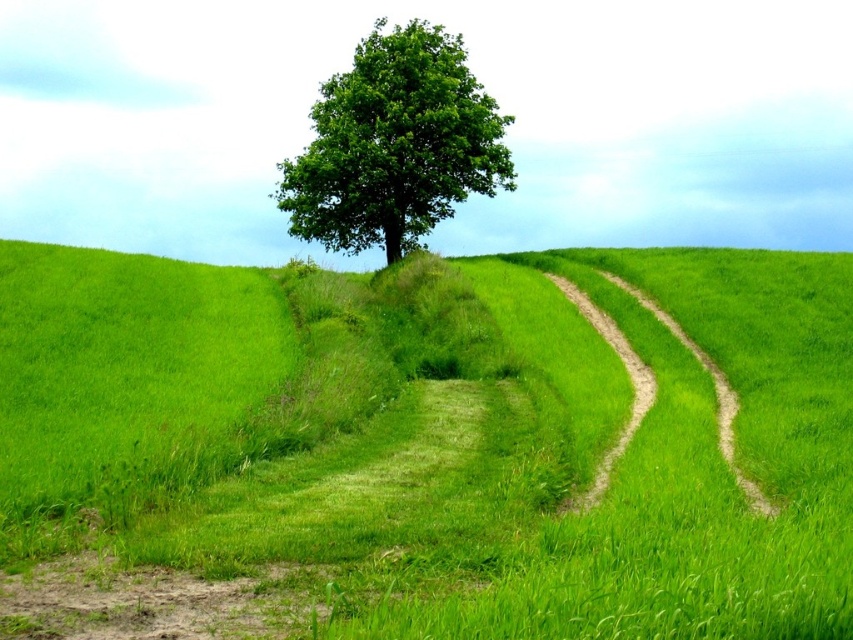
You are standing on the dirt path and want to walk towards the green leafy tree at center. Which direction should you walk to avoid the green grassy at center?

Since the green grassy at center is on the right side of the green leafy tree at center, you should walk to the left side of the green leafy tree at center to avoid it.

You are a hiker standing on the dirt path in the foreground of the scene. You want to walk towards the green leafy tree at center. Which direction should you walk to reach it from the green grassy at center?

The green grassy at center is below the green leafy tree at center, so to reach the tree, you should walk upwards from the green grassy at center.